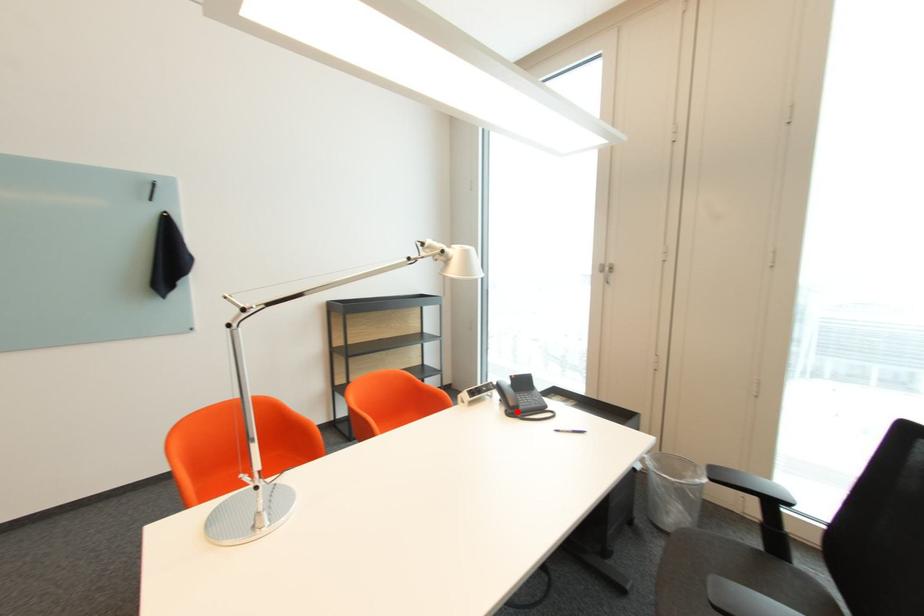
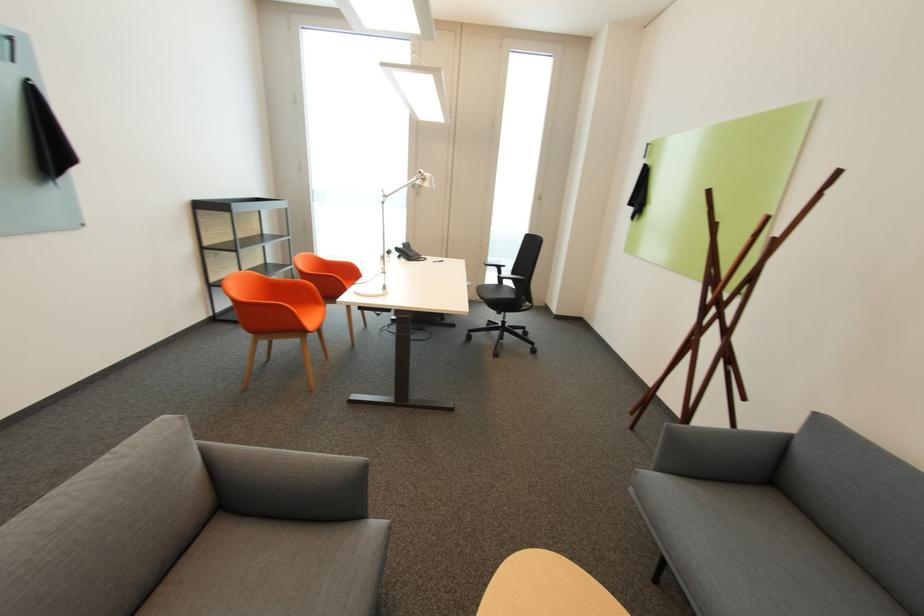
In the second image, find the point that corresponds to the highlighted location in the first image.

(419, 259)